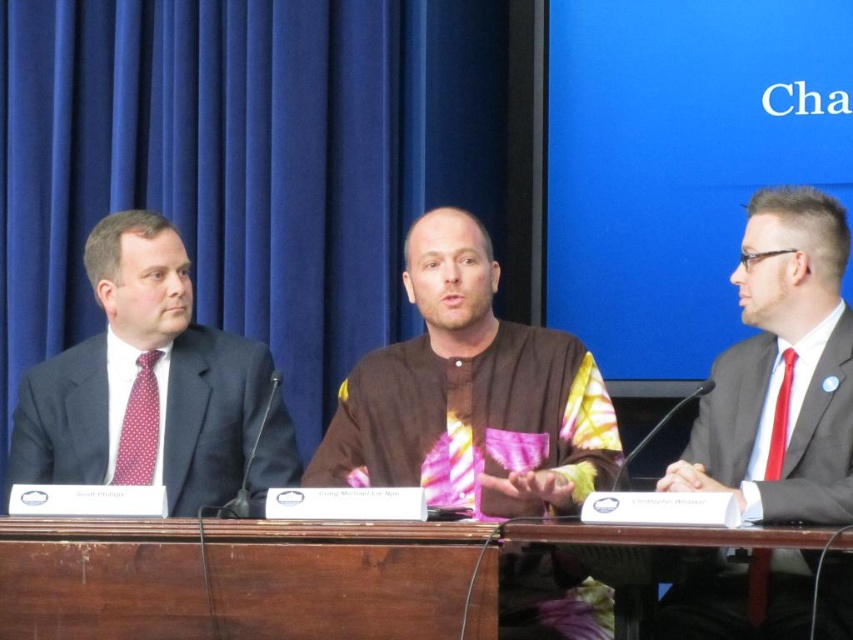
You are standing at the point marked by the coordinate point at (473, 490) in the image. You want to move to the blue backdrop with white text on the right side. Which direction should you move to reach it?

The blue backdrop with white text on the right side is located to your right, so you should move in that direction to reach it.

You are organizing a seating arrangement for a panel discussion and need to place a new chair next to the brown wooden table at center. Considering the size of the matte black suit at right, will there be enough space for the chair?

The brown wooden table at center is smaller than the matte black suit at right, so there might not be enough space for the new chair next to the table since the matte black suit at right occupies more space.

You are sitting at the table and want to pass a document to the person in the matte black suit at right without getting too close to the person in the dark gray suit at left. Which direction should you lean to accomplish this?

You should lean towards the right side of the table because the matte black suit at right is closer to you than the dark gray suit at left, allowing you to reach them without moving closer to the dark gray suit at left.